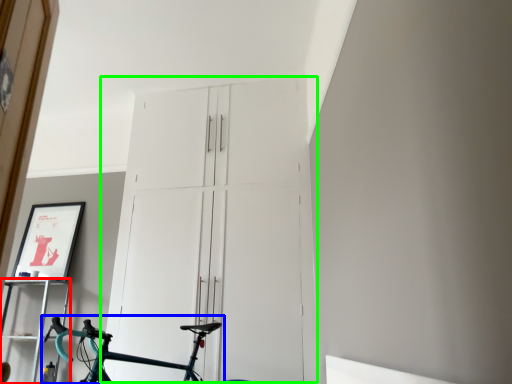
Question: Estimate the real-world distances between objects in this image. Which object is closer to shelf (highlighted by a red box), bicycle (highlighted by a blue box) or door (highlighted by a green box)?

Choices:
 (A) bicycle
 (B) door

Answer: (A)